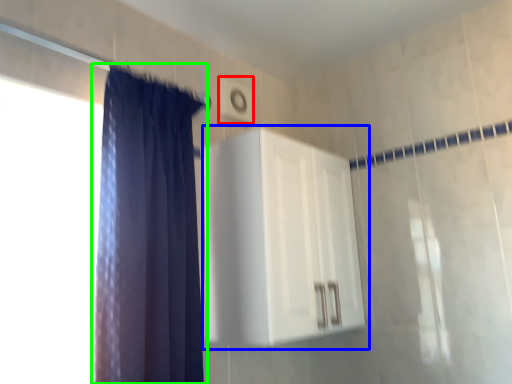
Question: Which object is positioned farthest from light switch (highlighted by a red box)? Select from dresser (highlighted by a blue box) and curtain (highlighted by a green box).

Choices:
 (A) dresser
 (B) curtain

Answer: (B)